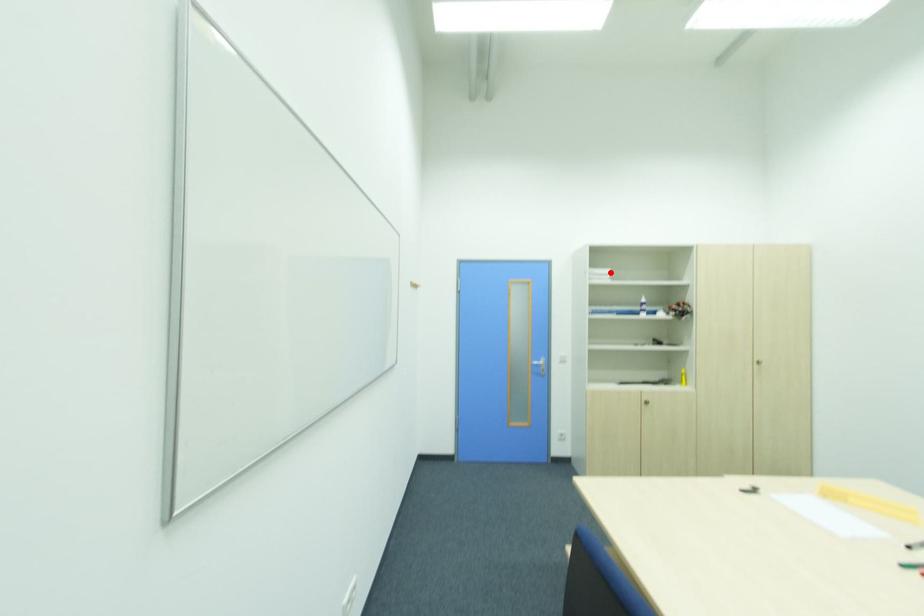
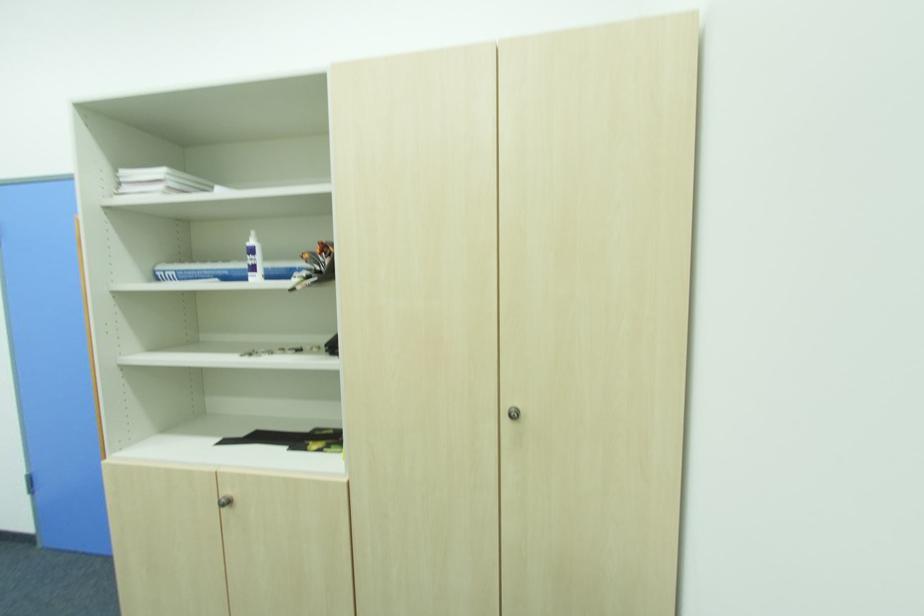
The point at the highlighted location is marked in the first image. Where is the corresponding point in the second image?

(161, 172)